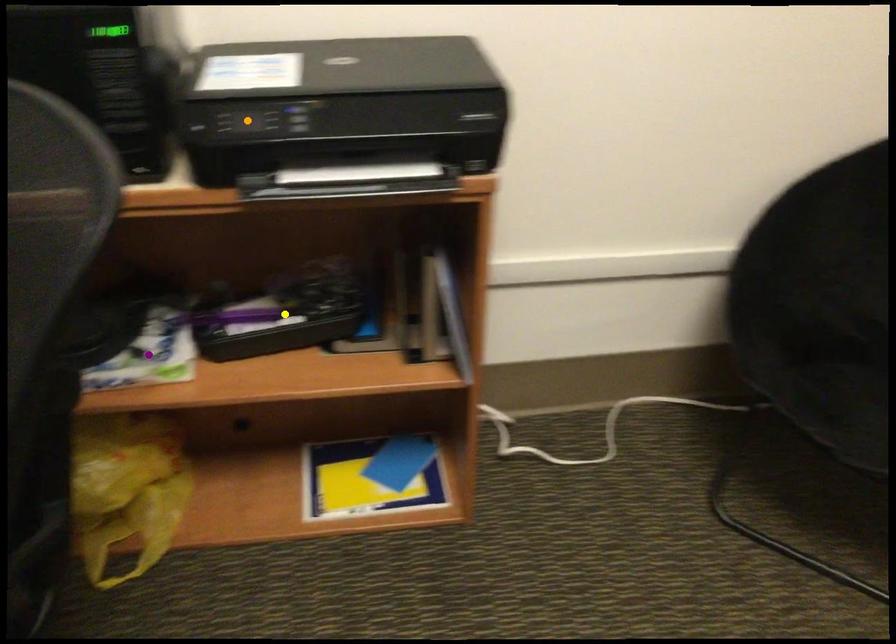
Order these from farthest to nearest:
yellow point
orange point
purple point

yellow point, purple point, orange point